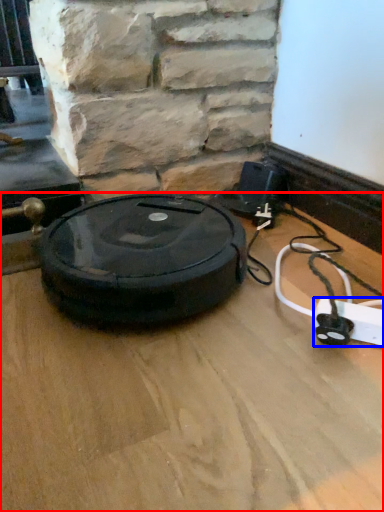
Question: Which object is closer to the camera taking this photo, surface (highlighted by a red box) or extension cord (highlighted by a blue box)?

Choices:
 (A) surface
 (B) extension cord

Answer: (A)